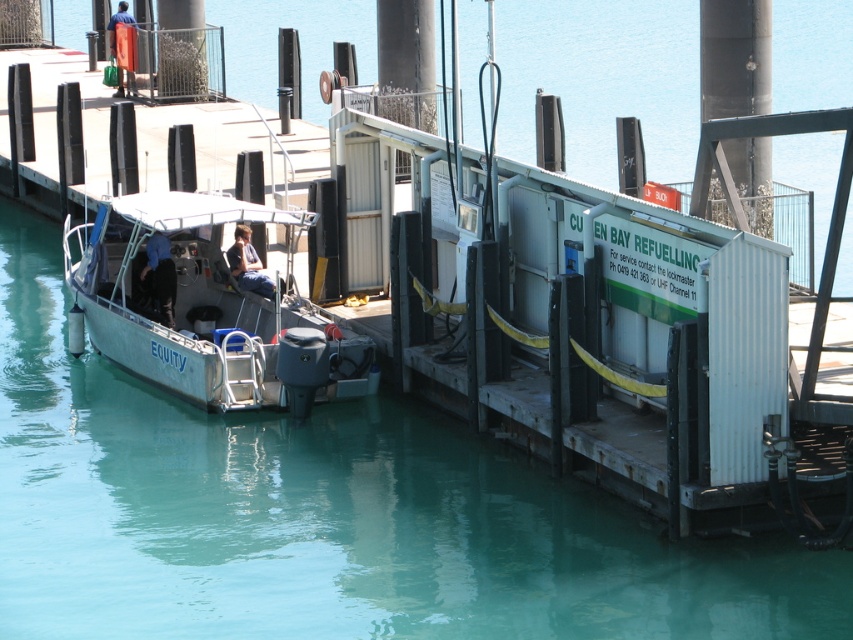
Looking at this image, can you confirm if metallic gray boat at center is positioned to the left of dark blue jeans at center?

Yes, metallic gray boat at center is to the left of dark blue jeans at center.

Where is `metallic gray boat at center`? metallic gray boat at center is located at coordinates pos(328,516).

Where is `metallic gray boat at center`? This screenshot has height=640, width=853. metallic gray boat at center is located at coordinates (328, 516).

Between point (259, 266) and point (120, 84), which one is positioned behind?

Point (120, 84)

Is dark blue jeans at center to the right of orange fabric bag at upper left from the viewer's perspective?

Yes, dark blue jeans at center is to the right of orange fabric bag at upper left.

Locate an element on the screen. This screenshot has width=853, height=640. dark blue jeans at center is located at coordinates (248, 264).

Can you confirm if dark blue fabric jacket at center is positioned above orange fabric bag at upper left?

Incorrect, dark blue fabric jacket at center is not positioned above orange fabric bag at upper left.

In order to click on dark blue fabric jacket at center in this screenshot , I will do `click(160, 276)`.